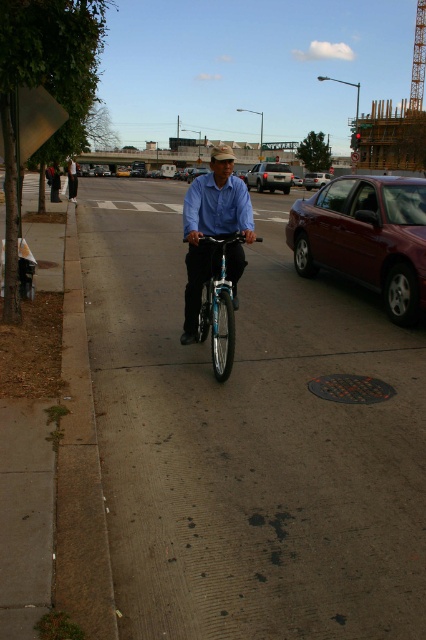
Consider the image. You are a delivery person trying to park your bicycle on the sidewalk. The bicycle requires 2 meters of space. Can you park your bicycle on the gray concrete sidewalk at center without blocking the shiny maroon sedan at right?

The gray concrete sidewalk at center is in front of the shiny maroon sedan at right, so there is space available. However, the description does not provide specific measurements of the sidewalk length. Therefore, it is uncertain if the 2 meters required for parking the bicycle is available.